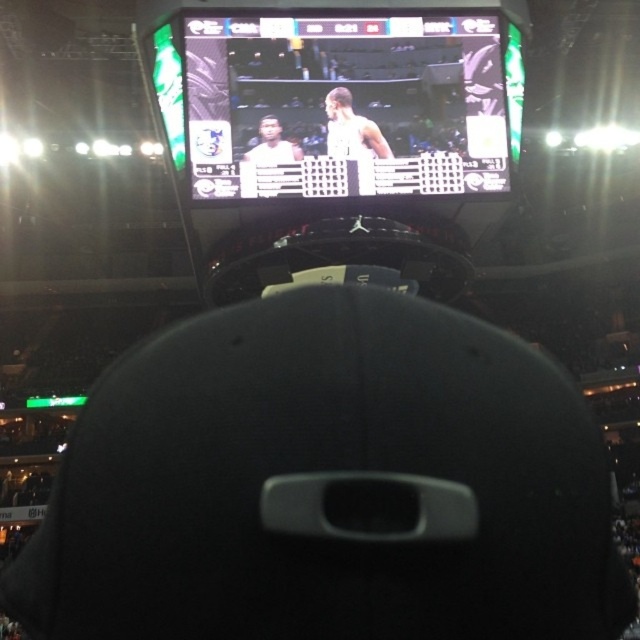
Question: Does black matte baseball cap at center have a larger size compared to matte white jersey at center?

Choices:
 (A) yes
 (B) no

Answer: (A)

Question: Does black matte baseball cap at center lie in front of white matte basketball player at center?

Choices:
 (A) yes
 (B) no

Answer: (A)

Question: Among these objects, which one is nearest to the camera?

Choices:
 (A) matte white jersey at center
 (B) white matte basketball player at center

Answer: (A)

Question: Considering the real-world distances, which object is farthest from the matte white jersey at center?

Choices:
 (A) white matte basketball player at center
 (B) matte black screen at upper center

Answer: (B)

Question: Observing the image, what is the correct spatial positioning of black matte baseball cap at center in reference to white matte basketball player at center?

Choices:
 (A) above
 (B) below

Answer: (B)

Question: Which object is the farthest from the matte black screen at upper center?

Choices:
 (A) matte white jersey at center
 (B) white matte basketball player at center

Answer: (A)